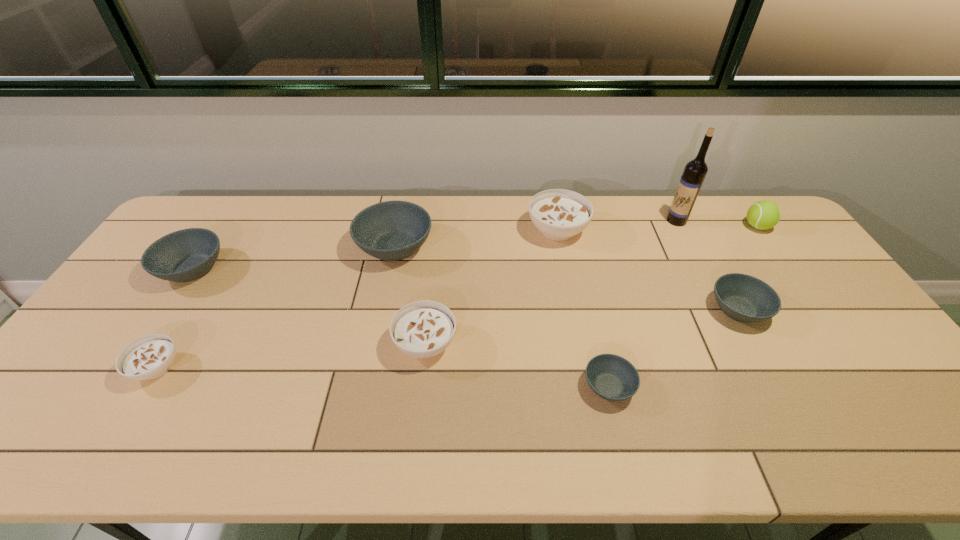
I want to click on free space located on the back of the second biggest gray soup bowl, so click(225, 220).

Identify the location of blank area located 0.170m on the front of the second smallest white soup bowl. This screenshot has height=540, width=960. (416, 436).

Identify the location of blank area located 0.150m on the left of the rightmost gray soup bowl. Image resolution: width=960 pixels, height=540 pixels. (656, 309).

You are a GUI agent. You are given a task and a screenshot of the screen. Output one action in this format:
    pyautogui.click(x=<x>, y=<y>)
    Task: Click on the vacant area situated 0.190m on the right of the smallest white soup bowl
    This screenshot has width=960, height=540.
    Given the screenshot: What is the action you would take?
    pyautogui.click(x=257, y=368)

You are a GUI agent. You are given a task and a screenshot of the screen. Output one action in this format:
    pyautogui.click(x=<x>, y=<y>)
    Task: Click on the blank space located on the left of the second gray soup bowl from right to left
    The width and height of the screenshot is (960, 540).
    Given the screenshot: What is the action you would take?
    pyautogui.click(x=444, y=387)

Where is `wine bottle that is at the far edge`? The width and height of the screenshot is (960, 540). wine bottle that is at the far edge is located at coordinates (694, 173).

The image size is (960, 540). Identify the location of tennis ball at the far edge. (762, 215).

You are a GUI agent. You are given a task and a screenshot of the screen. Output one action in this format:
    pyautogui.click(x=<x>, y=<y>)
    Task: Click on the object that is at the left edge
    The width and height of the screenshot is (960, 540).
    Given the screenshot: What is the action you would take?
    pyautogui.click(x=185, y=255)

Find the location of a particular element. Image resolution: width=960 pixels, height=540 pixels. object that is at the right edge is located at coordinates (762, 215).

The height and width of the screenshot is (540, 960). Find the location of `object positioned at the far right corner`. object positioned at the far right corner is located at coordinates (762, 215).